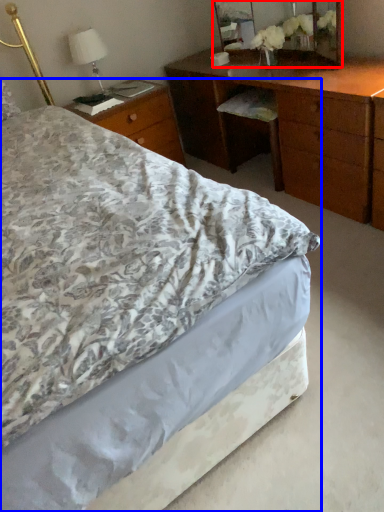
Question: Which point is closer to the camera, mirror (highlighted by a red box) or bed (highlighted by a blue box)?

Choices:
 (A) mirror
 (B) bed

Answer: (B)